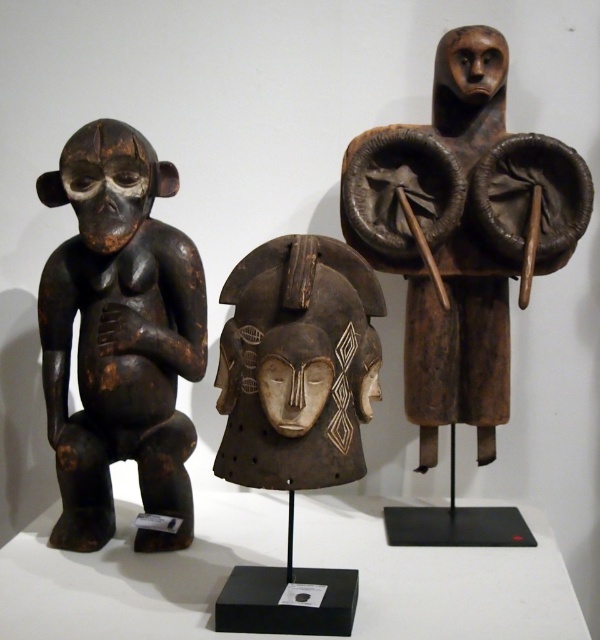
Question: Which of these objects is positioned closest to the brown wooden figure at upper right?

Choices:
 (A) dark brown wood mask at center
 (B) dark brown wood figure at left

Answer: (A)

Question: From the image, what is the correct spatial relationship of brown wooden figure at upper right in relation to dark brown wood mask at center?

Choices:
 (A) above
 (B) below

Answer: (A)

Question: Which point is closer to the camera?

Choices:
 (A) dark brown wood mask at center
 (B) brown wooden figure at upper right
 (C) dark brown wood figure at left

Answer: (A)

Question: Does brown wooden figure at upper right come in front of dark brown wood mask at center?

Choices:
 (A) no
 (B) yes

Answer: (A)

Question: Considering the real-world distances, which object is farthest from the brown wooden figure at upper right?

Choices:
 (A) dark brown wood mask at center
 (B) dark brown wood figure at left

Answer: (B)

Question: Can you confirm if dark brown wood figure at left is thinner than dark brown wood mask at center?

Choices:
 (A) yes
 (B) no

Answer: (B)